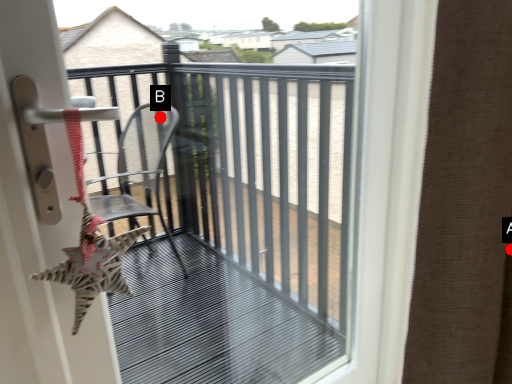
Question: Two points are circled on the image, labeled by A and B beside each circle. Which point is closer to the camera?

Choices:
 (A) A is closer
 (B) B is closer

Answer: (A)